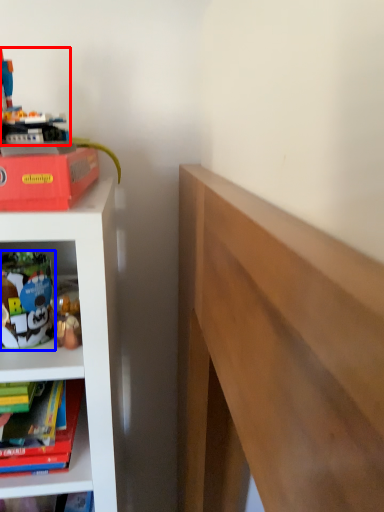
Question: Which of the following is the farthest to the observer, toy (highlighted by a red box) or toy (highlighted by a blue box)?

Choices:
 (A) toy
 (B) toy

Answer: (B)